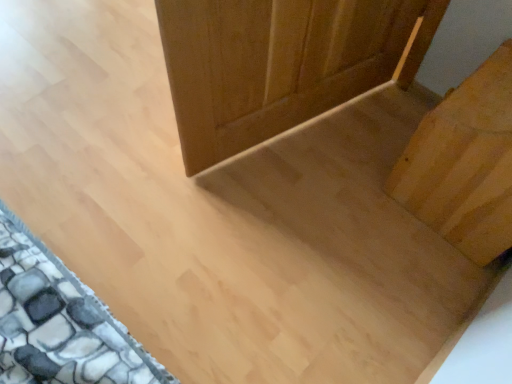
Locate an element on the screen. The image size is (512, 384). free point to the left of natural wood door at lower right is located at coordinates (352, 183).